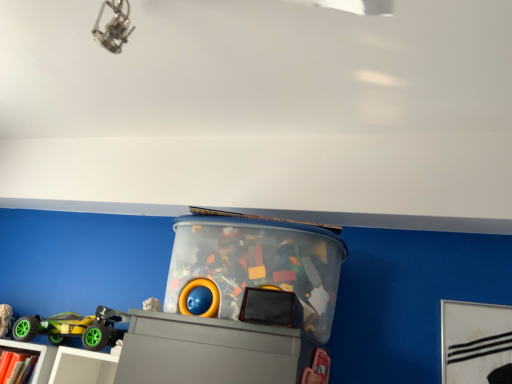
Image resolution: width=512 pixels, height=384 pixels. What do you see at coordinates (73, 328) in the screenshot? I see `green rubber toy car at lower left, which appears as the first toy when viewed from the left` at bounding box center [73, 328].

This screenshot has height=384, width=512. What do you see at coordinates (33, 354) in the screenshot? I see `matte white bookcase at lower left` at bounding box center [33, 354].

You are a GUI agent. You are given a task and a screenshot of the screen. Output one action in this format:
    pyautogui.click(x=<x>, y=<y>)
    Task: Click on the matte gray shelf at lower left
    
    Given the screenshot: What is the action you would take?
    pyautogui.click(x=68, y=364)

Is point (48, 350) positioned in front of point (209, 267)?

No, (48, 350) is further to viewer.

Is matte white bookcase at lower left far from transparent plastic container at center, the 1th toy when ordered from right to left?

No.

Locate an element on the screen. the 2nd toy positioned above the matte white bookcase at lower left (from a real-world perspective) is located at coordinates pos(258,264).

Between matte white bookcase at lower left and transparent plastic container at center, the 1th toy when ordered from right to left, which one has more height?

transparent plastic container at center, the 1th toy when ordered from right to left.

Are matte gray shelf at lower left and green rubber toy car at lower left, which appears as the first toy when viewed from the left, beside each other?

Yes, matte gray shelf at lower left is touching green rubber toy car at lower left, which appears as the first toy when viewed from the left.

Can you confirm if matte gray shelf at lower left is wider than green rubber toy car at lower left, which appears as the first toy when viewed from the left?

Correct, the width of matte gray shelf at lower left exceeds that of green rubber toy car at lower left, which appears as the first toy when viewed from the left.

Is matte gray shelf at lower left oriented towards green rubber toy car at lower left, placed as the second toy when sorted from right to left?

No.

This screenshot has height=384, width=512. Identify the location of shelf in front of the green rubber toy car at lower left, which appears as the first toy when viewed from the left. (68, 364).

From a real-world perspective, relative to matte gray shelf at lower left, is green rubber toy car at lower left, placed as the second toy when sorted from right to left, vertically above or below?

Clearly, from a real-world perspective, green rubber toy car at lower left, placed as the second toy when sorted from right to left, is above matte gray shelf at lower left.

Is matte gray shelf at lower left at the back of green rubber toy car at lower left, placed as the second toy when sorted from right to left?

That's not correct — green rubber toy car at lower left, placed as the second toy when sorted from right to left, is not looking away from matte gray shelf at lower left.

Is green rubber toy car at lower left, which appears as the first toy when viewed from the left, spatially inside matte gray shelf at lower left, or outside of it?

green rubber toy car at lower left, which appears as the first toy when viewed from the left, is not inside matte gray shelf at lower left, it's outside.

Which object is further away from the camera, matte gray shelf at lower left or transparent plastic container at center, the 1th toy when ordered from right to left?

matte gray shelf at lower left is more distant.

Which point is more forward, (90, 383) or (329, 243)?

Positioned in front is point (329, 243).

Is matte gray shelf at lower left bigger than transparent plastic container at center, which ranks as the 2th toy in left-to-right order?

No, matte gray shelf at lower left is not bigger than transparent plastic container at center, which ranks as the 2th toy in left-to-right order.

From the picture: Would you say matte white bookcase at lower left is a long distance from green rubber toy car at lower left, which appears as the first toy when viewed from the left?

No.

Is matte white bookcase at lower left bigger or smaller than green rubber toy car at lower left, placed as the second toy when sorted from right to left?

Considering their sizes, matte white bookcase at lower left takes up less space than green rubber toy car at lower left, placed as the second toy when sorted from right to left.

From the image's perspective, count 1st toys upward from the matte white bookcase at lower left and point to it. Please provide its 2D coordinates.

[(73, 328)]

Is matte white bookcase at lower left turned away from matte gray shelf at lower left?

Yes, matte white bookcase at lower left's orientation is away from matte gray shelf at lower left.

Does matte white bookcase at lower left have a lesser width compared to matte gray shelf at lower left?

Yes, matte white bookcase at lower left is thinner than matte gray shelf at lower left.

Is matte white bookcase at lower left spatially inside matte gray shelf at lower left, or outside of it?

matte white bookcase at lower left fits inside matte gray shelf at lower left.

Is matte white bookcase at lower left not near matte gray shelf at lower left?

matte white bookcase at lower left is near matte gray shelf at lower left, not far away.

Is transparent plastic container at center, which ranks as the 2th toy in left-to-right order, further to camera compared to matte gray shelf at lower left?

No, transparent plastic container at center, which ranks as the 2th toy in left-to-right order, is closer to the camera.

Considering the positions of point (237, 296) and point (101, 373), is point (237, 296) closer or farther from the camera than point (101, 373)?

Point (237, 296) is closer to the camera than point (101, 373).

From the image's perspective, between transparent plastic container at center, which ranks as the 2th toy in left-to-right order, and matte gray shelf at lower left, which one is located above?

From the image's view, transparent plastic container at center, which ranks as the 2th toy in left-to-right order, is above.

Is transparent plastic container at center, the 1th toy when ordered from right to left, facing away from matte gray shelf at lower left?

transparent plastic container at center, the 1th toy when ordered from right to left, is not turned away from matte gray shelf at lower left.

From the image's perspective, count 2nd toys upward from the matte white bookcase at lower left and point to it. Please provide its 2D coordinates.

[(258, 264)]

Find the location of a particular element. shelf to the left of green rubber toy car at lower left, placed as the second toy when sorted from right to left is located at coordinates coord(68,364).

When comparing their distances from matte white bookcase at lower left, does matte gray shelf at lower left or green rubber toy car at lower left, which appears as the first toy when viewed from the left, seem closer?

The object closer to matte white bookcase at lower left is matte gray shelf at lower left.

When comparing their distances from green rubber toy car at lower left, placed as the second toy when sorted from right to left, does matte white bookcase at lower left or matte gray shelf at lower left seem closer?

The object closer to green rubber toy car at lower left, placed as the second toy when sorted from right to left, is matte gray shelf at lower left.

Considering their positions, is transparent plastic container at center, which ranks as the 2th toy in left-to-right order, positioned further to matte white bookcase at lower left than matte gray shelf at lower left?

transparent plastic container at center, which ranks as the 2th toy in left-to-right order.

Looking at the image, which one is located closer to matte gray shelf at lower left, transparent plastic container at center, the 1th toy when ordered from right to left, or matte white bookcase at lower left?

matte white bookcase at lower left.

From the image, which object appears to be farther from transparent plastic container at center, the 1th toy when ordered from right to left, matte gray shelf at lower left or matte white bookcase at lower left?

The object further to transparent plastic container at center, the 1th toy when ordered from right to left, is matte white bookcase at lower left.

Considering their positions, is matte gray shelf at lower left positioned closer to matte white bookcase at lower left than transparent plastic container at center, the 1th toy when ordered from right to left?

Based on the image, matte gray shelf at lower left appears to be nearer to matte white bookcase at lower left.

Which object lies nearer to the anchor point transparent plastic container at center, the 1th toy when ordered from right to left, green rubber toy car at lower left, which appears as the first toy when viewed from the left, or matte white bookcase at lower left?

green rubber toy car at lower left, which appears as the first toy when viewed from the left, is closer to transparent plastic container at center, the 1th toy when ordered from right to left.

Considering their positions, is green rubber toy car at lower left, which appears as the first toy when viewed from the left, positioned closer to matte gray shelf at lower left than transparent plastic container at center, the 1th toy when ordered from right to left?

green rubber toy car at lower left, which appears as the first toy when viewed from the left, lies closer to matte gray shelf at lower left than the other object.

Where is `shelf situated between matte white bookcase at lower left and transparent plastic container at center, which ranks as the 2th toy in left-to-right order, from left to right`? Image resolution: width=512 pixels, height=384 pixels. shelf situated between matte white bookcase at lower left and transparent plastic container at center, which ranks as the 2th toy in left-to-right order, from left to right is located at coordinates (68, 364).

You are a GUI agent. You are given a task and a screenshot of the screen. Output one action in this format:
    pyautogui.click(x=<x>, y=<y>)
    Task: Click on the toy between matte white bookcase at lower left and transparent plastic container at center, which ranks as the 2th toy in left-to-right order
    
    Given the screenshot: What is the action you would take?
    pyautogui.click(x=73, y=328)

Locate an element on the screen. The image size is (512, 384). toy between matte gray shelf at lower left and transparent plastic container at center, the 1th toy when ordered from right to left is located at coordinates (73, 328).

The height and width of the screenshot is (384, 512). In order to click on shelf situated between matte white bookcase at lower left and green rubber toy car at lower left, which appears as the first toy when viewed from the left, from left to right in this screenshot , I will do `click(68, 364)`.